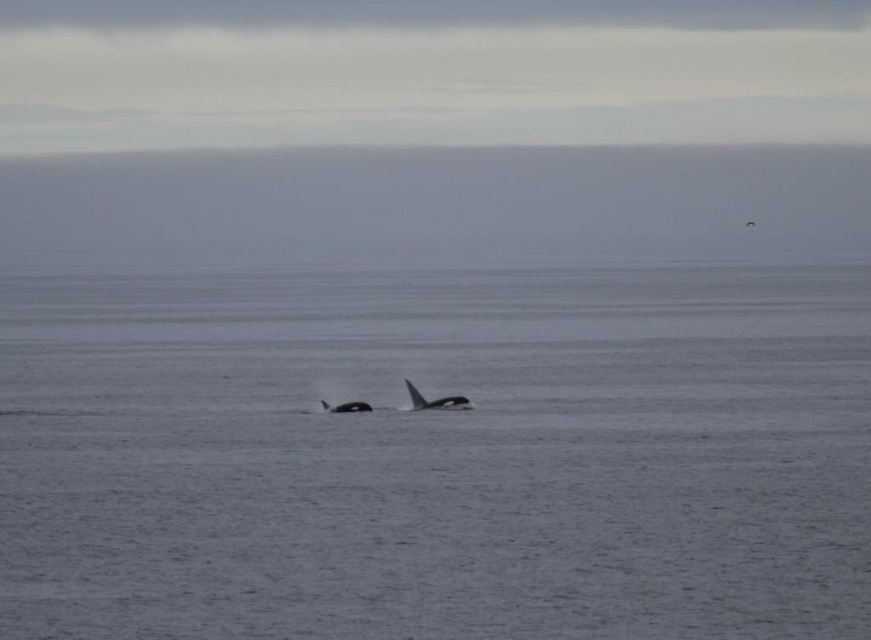
Question: Is black matte whale at center to the right of black smooth whale at center from the viewer's perspective?

Choices:
 (A) yes
 (B) no

Answer: (A)

Question: Which object is farther from the camera taking this photo?

Choices:
 (A) black smooth whale at center
 (B) black matte whale at center
 (C) gray water at center

Answer: (A)

Question: Which of the following is the farthest from the observer?

Choices:
 (A) black matte whale at center
 (B) black smooth whale at center
 (C) gray water at center

Answer: (B)

Question: Which of the following is the closest to the observer?

Choices:
 (A) gray water at center
 (B) black smooth whale at center

Answer: (A)

Question: Can you confirm if gray water at center is bigger than black matte whale at center?

Choices:
 (A) yes
 (B) no

Answer: (A)

Question: Can you confirm if gray water at center is bigger than black smooth whale at center?

Choices:
 (A) yes
 (B) no

Answer: (A)